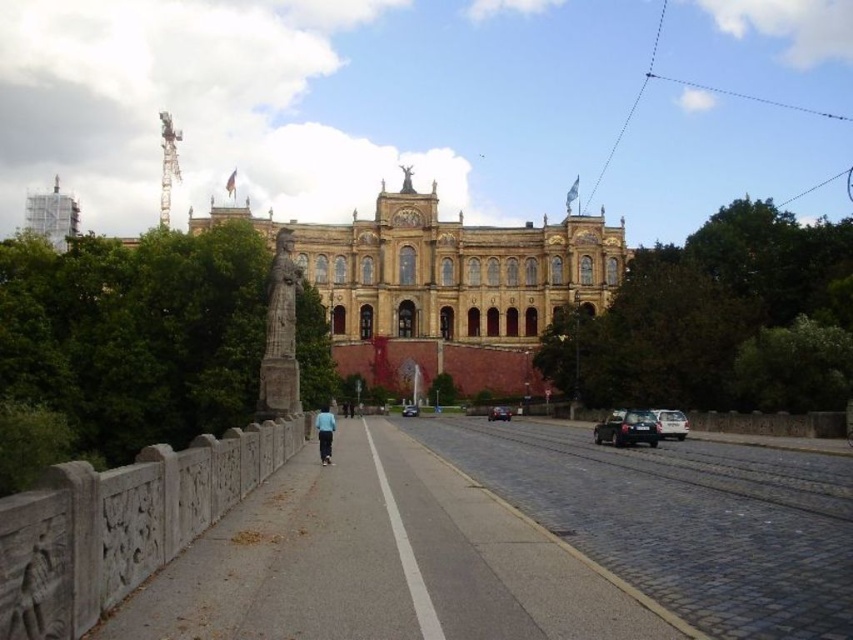
Question: Which of the following is the farthest from the observer?

Choices:
 (A) (682, 438)
 (B) (334, 424)

Answer: (A)

Question: Is brown stone building at center above blue fabric shirt at center?

Choices:
 (A) yes
 (B) no

Answer: (A)

Question: Which is farther from the white glossy car at right?

Choices:
 (A) shiny black sedan at center
 (B) shiny black car at right

Answer: (A)

Question: Which object appears closest to the camera in this image?

Choices:
 (A) shiny black car at center
 (B) blue fabric shirt at center
 (C) white glossy car at right
 (D) shiny black sedan at center

Answer: (B)

Question: Is shiny black sedan at center thinner than shiny black car at center?

Choices:
 (A) no
 (B) yes

Answer: (A)

Question: Does shiny black sedan at center come behind shiny black car at center?

Choices:
 (A) no
 (B) yes

Answer: (B)